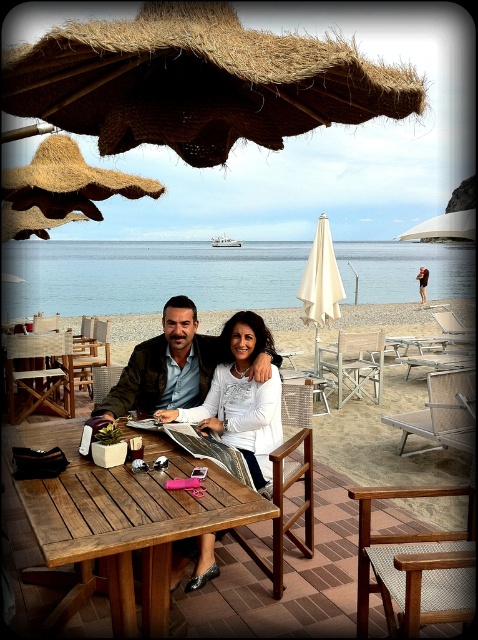
Which is above, wooden table at center or beige fabric umbrella at center?

beige fabric umbrella at center is above.

Identify the location of wooden table at center. The width and height of the screenshot is (478, 640). (121, 518).

Does point (152, 547) lie behind point (321, 289)?

No, (152, 547) is in front of (321, 289).

Locate an element on the screen. This screenshot has width=478, height=640. wooden table at center is located at coordinates (121, 518).

Describe the element at coordinates (165, 365) in the screenshot. I see `matte brown jacket at center` at that location.

Is matte brown jacket at center taller than wooden picnic table at center?

No, matte brown jacket at center is not taller than wooden picnic table at center.

Is point (126, 376) farther from viewer compared to point (63, 392)?

That is False.

Where is `matte brown jacket at center`? matte brown jacket at center is located at coordinates (165, 365).

Between wooden table at center and matte brown jacket at center, which one is positioned lower?

wooden table at center

Can you confirm if wooden table at center is positioned to the left of matte brown jacket at center?

Indeed, wooden table at center is positioned on the left side of matte brown jacket at center.

Is point (54, 432) in front of point (117, 410)?

Yes, point (54, 432) is closer to viewer.

In order to click on wooden table at center in this screenshot , I will do `click(121, 518)`.